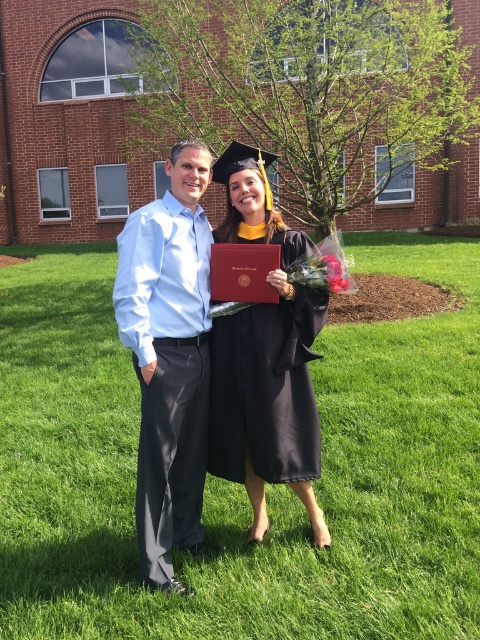
Question: Is green grass at center in front of light blue shirt at center?

Choices:
 (A) no
 (B) yes

Answer: (B)

Question: Which of the following is the farthest from the observer?

Choices:
 (A) (262, 445)
 (B) (158, 493)
 (C) (251, 385)

Answer: (C)

Question: Among these objects, which one is nearest to the camera?

Choices:
 (A) matte black gown at center
 (B) black matte graduation gown at center
 (C) green grass at center

Answer: (C)

Question: From the image, what is the correct spatial relationship of green grass at center in relation to matte black gown at center?

Choices:
 (A) below
 (B) above

Answer: (A)

Question: Can you confirm if green grass at center is positioned below matte black gown at center?

Choices:
 (A) no
 (B) yes

Answer: (B)

Question: Which point appears closest to the camera in this image?

Choices:
 (A) (120, 387)
 (B) (299, 458)
 (C) (197, 269)
 (D) (190, 429)

Answer: (C)